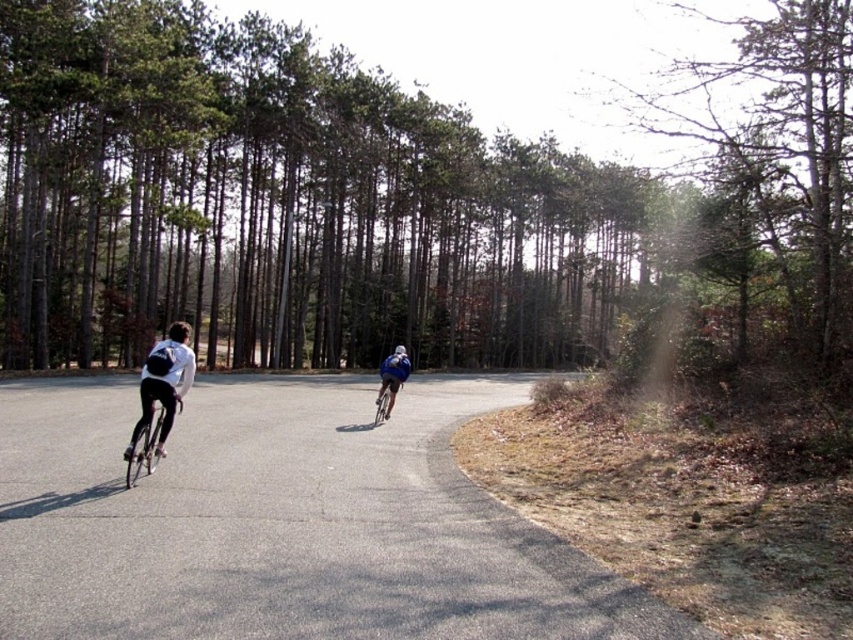
Does matte black bicycle at left appear on the left side of shiny metallic bicycle at left?

Indeed, matte black bicycle at left is positioned on the left side of shiny metallic bicycle at left.

Is matte black bicycle at left below shiny metallic bicycle at left?

Incorrect, matte black bicycle at left is not positioned below shiny metallic bicycle at left.

Which is behind, point (135, 422) or point (158, 406)?

The point (135, 422) is more distant.

Find the location of a particular element. matte black bicycle at left is located at coordinates (164, 381).

Can you confirm if green leafy trees at center is thinner than blue matte jacket at center?

Incorrect, green leafy trees at center's width is not less than blue matte jacket at center's.

Can you confirm if green leafy trees at center is positioned below blue matte jacket at center?

Actually, green leafy trees at center is above blue matte jacket at center.

At what (x,y) coordinates should I click in order to perform the action: click on green leafy trees at center. Please return your answer as a coordinate pair (x, y). The height and width of the screenshot is (640, 853). Looking at the image, I should click on (399, 196).

Is blue matte jacket at center thinner than blue matte helmet at center?

No, blue matte jacket at center is not thinner than blue matte helmet at center.

Can you confirm if blue matte jacket at center is smaller than blue matte helmet at center?

Incorrect, blue matte jacket at center is not smaller in size than blue matte helmet at center.

Consider the image. Who is more forward, (x=392, y=385) or (x=395, y=353)?

Point (x=392, y=385) is more forward.

Where is `blue matte jacket at center`? The height and width of the screenshot is (640, 853). blue matte jacket at center is located at coordinates (392, 376).